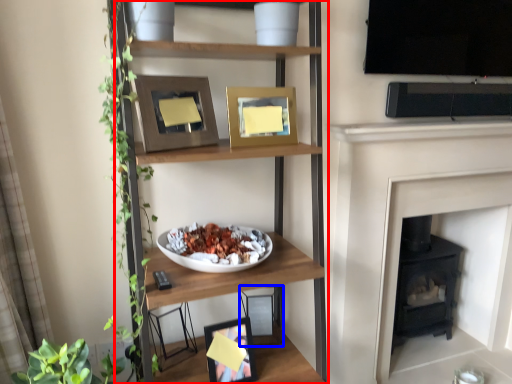
Question: Which of the following is the farthest to the observer, shelf (highlighted by a red box) or picture frame (highlighted by a blue box)?

Choices:
 (A) shelf
 (B) picture frame

Answer: (B)